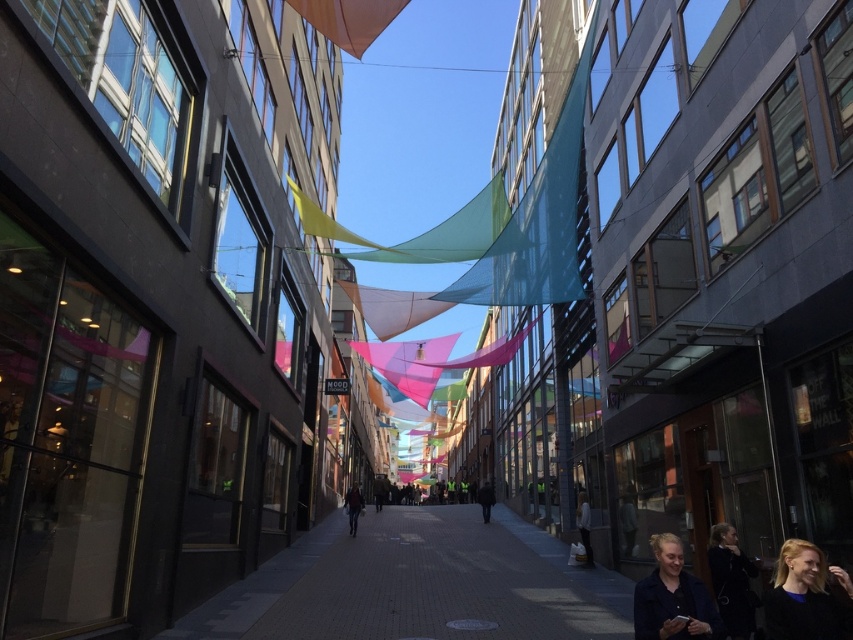
Question: Which point appears closest to the camera in this image?

Choices:
 (A) (589, 550)
 (B) (793, 616)
 (C) (670, 564)
 (D) (460, 605)

Answer: (B)

Question: Is dark blue jacket at lower right to the right of dark blue jeans at center from the viewer's perspective?

Choices:
 (A) no
 (B) yes

Answer: (B)

Question: Can you confirm if paved brick sidewalk at center is thinner than dark gray sweater at lower right?

Choices:
 (A) no
 (B) yes

Answer: (A)

Question: Which of the following is the closest to the observer?

Choices:
 (A) dark gray sweater at lower right
 (B) dark blue jacket at lower right

Answer: (B)

Question: Can you confirm if dark blue jacket at lower right is wider than dark gray jacket at center?

Choices:
 (A) no
 (B) yes

Answer: (A)

Question: Which of these objects is positioned closest to the blonde hair at lower right?

Choices:
 (A) dark gray sweater at lower right
 (B) dark gray jacket at center
 (C) dark blue jeans at center

Answer: (A)